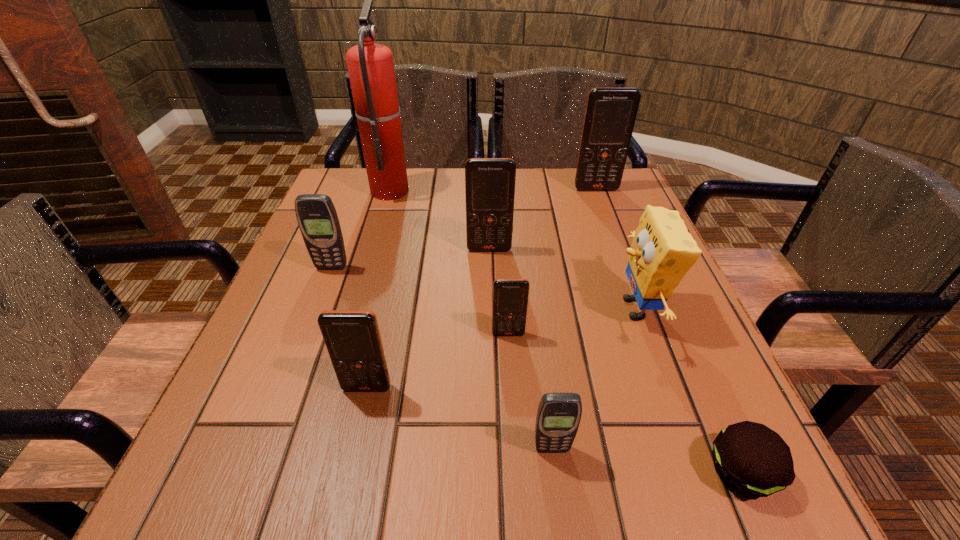
Locate an element on the screen. This screenshot has width=960, height=540. fire extinguisher is located at coordinates (370, 65).

Identify the location of the tallest object. (370, 65).

This screenshot has height=540, width=960. Identify the location of the farthest cellular telephone. (610, 115).

Find the location of `the rightmost orange cellular telephone`. the rightmost orange cellular telephone is located at coordinates (610, 115).

You are a GUI agent. You are given a task and a screenshot of the screen. Output one action in this format:
    pyautogui.click(x=<x>, y=<y>)
    Task: Click on the second biggest orange cellular telephone
    The width and height of the screenshot is (960, 540).
    Given the screenshot: What is the action you would take?
    pyautogui.click(x=489, y=182)

Find the location of a particular element. This screenshot has height=540, width=960. the second farthest orange cellular telephone is located at coordinates (489, 182).

The height and width of the screenshot is (540, 960). What are the coordinates of `sponge` in the screenshot? It's located at (662, 252).

Identify the location of the leftmost cellular telephone. (317, 218).

Identify the location of the left gray cellular telephone. (317, 218).

Locate an element on the screen. The height and width of the screenshot is (540, 960). the second smallest orange cellular telephone is located at coordinates (352, 337).